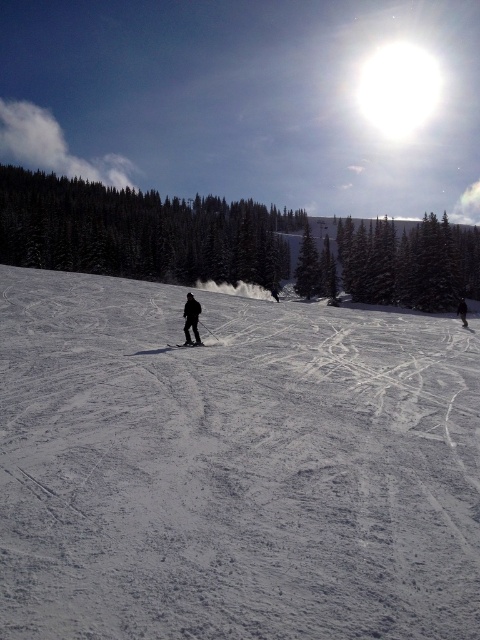
Between green textured pine tree at left and black matte ski at center, which one has more height?

Standing taller between the two is green textured pine tree at left.

Does point (261, 205) come closer to viewer compared to point (181, 342)?

No.

Image resolution: width=480 pixels, height=640 pixels. What do you see at coordinates (140, 230) in the screenshot?
I see `green textured pine tree at left` at bounding box center [140, 230].

Identify the location of green textured pine tree at left. Image resolution: width=480 pixels, height=640 pixels. (140, 230).

Does white powdery snow at center have a greater height compared to black snowsuit at center?

Correct, white powdery snow at center is much taller as black snowsuit at center.

At what (x,y) coordinates should I click in order to perform the action: click on white powdery snow at center. Please return your answer as a coordinate pair (x, y). The width and height of the screenshot is (480, 640). Looking at the image, I should click on (232, 467).

Locate an element on the screen. white powdery snow at center is located at coordinates (232, 467).

Which is below, black matte skier at center or black matte ski at center?

black matte ski at center is below.

Is point (196, 323) closer to camera compared to point (182, 344)?

No, it is behind (182, 344).

Between point (194, 321) and point (172, 346), which one is positioned in front?

Positioned in front is point (172, 346).

Locate an element on the screen. This screenshot has width=480, height=640. black matte skier at center is located at coordinates (191, 317).